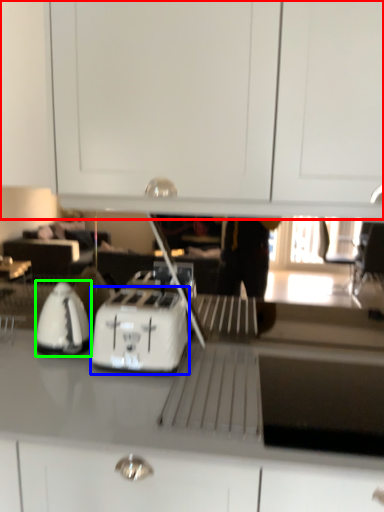
Question: Based on their relative distances, which object is farther from dresser (highlighted by a red box)? Choose from kitchen appliance (highlighted by a blue box) and home appliance (highlighted by a green box).

Choices:
 (A) kitchen appliance
 (B) home appliance

Answer: (B)